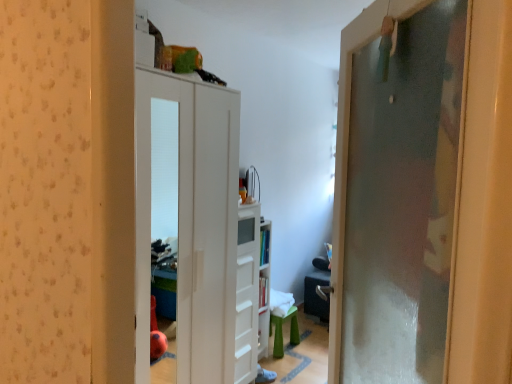
Question: Which direction should I rotate to face white matte cabinet at center, marked as the 1th door in a left-to-right arrangement, — up or down?

Choices:
 (A) up
 (B) down

Answer: (B)

Question: Is white plastic bookshelf at center completely or partially inside frosted glass door at right, the second door in the back-to-front sequence?

Choices:
 (A) no
 (B) yes

Answer: (A)

Question: Is frosted glass door at right, arranged as the 1th door when viewed from the front, oriented towards white plastic bookshelf at center?

Choices:
 (A) yes
 (B) no

Answer: (B)

Question: From a real-world perspective, is frosted glass door at right, the second door in the back-to-front sequence, located beneath white plastic bookshelf at center?

Choices:
 (A) no
 (B) yes

Answer: (A)

Question: Does frosted glass door at right, the second door in the back-to-front sequence, have a greater height compared to white plastic bookshelf at center?

Choices:
 (A) no
 (B) yes

Answer: (B)

Question: Is the depth of frosted glass door at right, the second door when ordered from left to right, greater than that of white plastic bookshelf at center?

Choices:
 (A) no
 (B) yes

Answer: (A)

Question: Does frosted glass door at right, the second door in the back-to-front sequence, have a greater width compared to white plastic bookshelf at center?

Choices:
 (A) yes
 (B) no

Answer: (A)

Question: Is white glossy dresser at center taller than white matte cabinet at center, the second door viewed from the right?

Choices:
 (A) no
 (B) yes

Answer: (A)

Question: Is white glossy dresser at center touching white matte cabinet at center, which ranks as the first door in back-to-front order?

Choices:
 (A) yes
 (B) no

Answer: (B)

Question: Is white glossy dresser at center thinner than white matte cabinet at center, marked as the 1th door in a left-to-right arrangement?

Choices:
 (A) no
 (B) yes

Answer: (B)

Question: Does white glossy dresser at center appear on the left side of white matte cabinet at center, which ranks as the first door in back-to-front order?

Choices:
 (A) yes
 (B) no

Answer: (B)

Question: Is white glossy dresser at center positioned before white matte cabinet at center, the second door viewed from the right?

Choices:
 (A) no
 (B) yes

Answer: (A)

Question: Considering the relative sizes of white glossy dresser at center and white matte cabinet at center, marked as the 1th door in a left-to-right arrangement, in the image provided, is white glossy dresser at center shorter than white matte cabinet at center, marked as the 1th door in a left-to-right arrangement,?

Choices:
 (A) yes
 (B) no

Answer: (A)

Question: Can you confirm if frosted glass door at right, the 1th door in the right-to-left sequence, is positioned to the right of white matte cabinet at center, which ranks as the first door in back-to-front order?

Choices:
 (A) yes
 (B) no

Answer: (A)